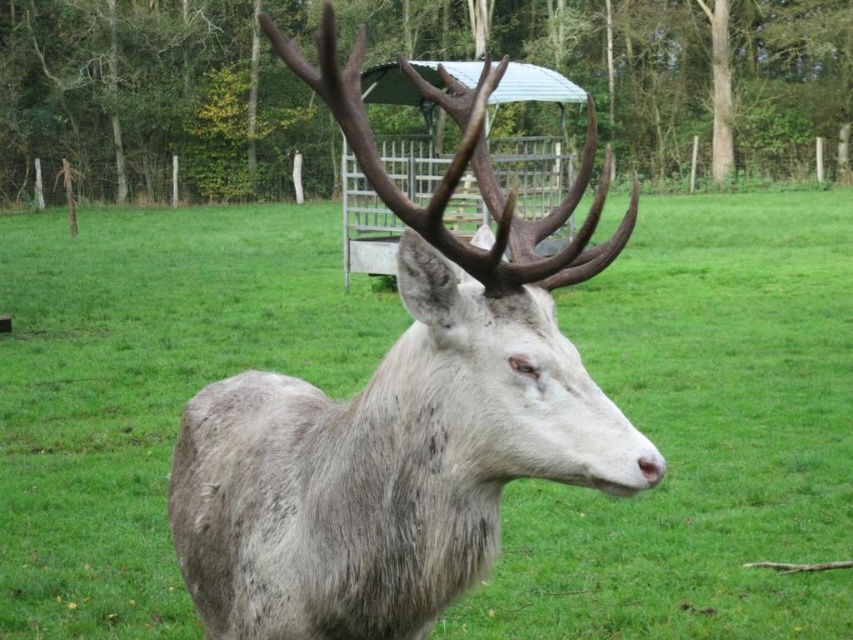
Question: Which point appears closest to the camera in this image?

Choices:
 (A) (486, 474)
 (B) (788, 376)

Answer: (A)

Question: Can you confirm if fuzzy gray deer at center is positioned to the left of gray matte fur at center?

Choices:
 (A) no
 (B) yes

Answer: (B)

Question: Which point is farther from the camera taking this photo?

Choices:
 (A) (653, 342)
 (B) (544, 396)

Answer: (A)

Question: Among these objects, which one is nearest to the camera?

Choices:
 (A) gray matte fur at center
 (B) fuzzy gray deer at center

Answer: (A)

Question: Is fuzzy gray deer at center smaller than gray matte fur at center?

Choices:
 (A) yes
 (B) no

Answer: (B)

Question: Can you confirm if fuzzy gray deer at center is smaller than gray matte fur at center?

Choices:
 (A) yes
 (B) no

Answer: (B)